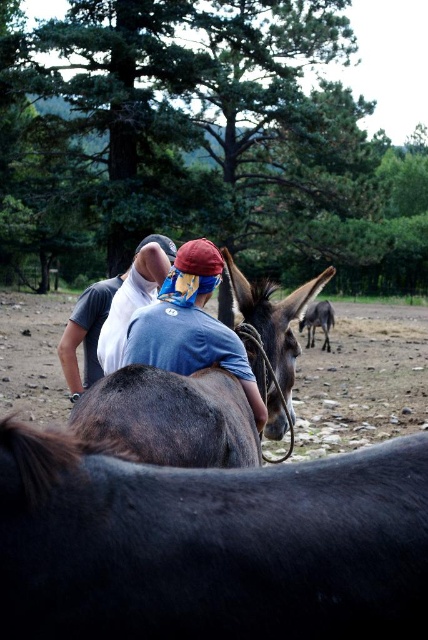
You are a photographer trying to capture a closeup of the brown matte mule at center and the blue fabric bandana at center. Since the mule is smaller than the bandana, which object should you zoom in on to ensure both fit in the frame?

The brown matte mule at center is smaller than the blue fabric bandana at center, so you should zoom in on the blue fabric bandana at center to ensure both fit in the frame.

You are standing in the rural outdoor scene described. There is a point at coordinates (169, 419). What object is located at this point?

The point at coordinates (169, 419) corresponds to the brown matte mule at center.

You are a photographer trying to capture a clear shot of the brown matte mule at center and the blue fabric bandana at center. Which object is blocking the view of the other?

The brown matte mule at center is positioned under the blue fabric bandana at center, so the blue fabric bandana at center is blocking the view of the brown matte mule at center.